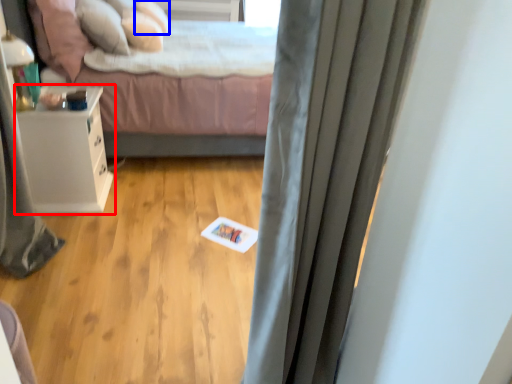
Question: Which point is further to the camera, nightstand (highlighted by a red box) or pillow (highlighted by a blue box)?

Choices:
 (A) nightstand
 (B) pillow

Answer: (B)